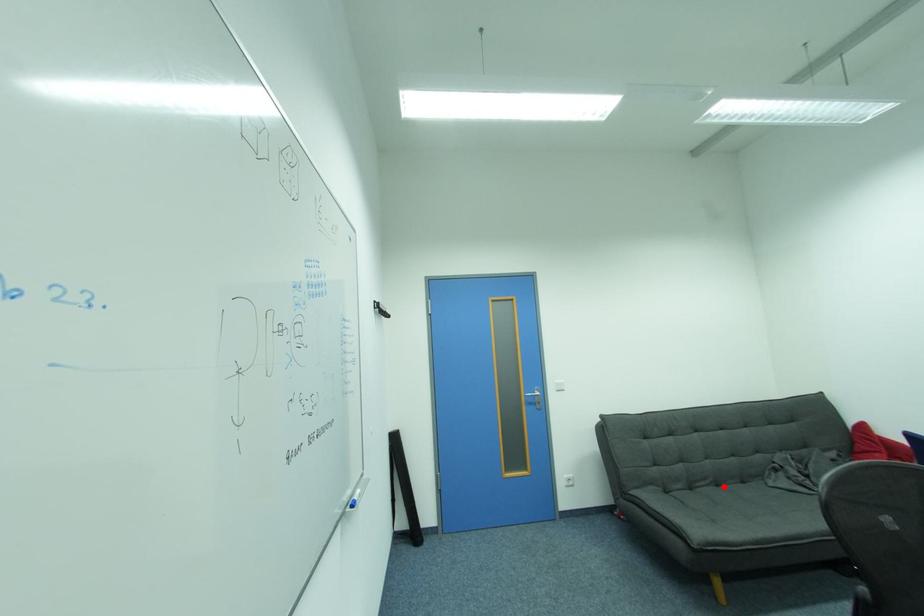
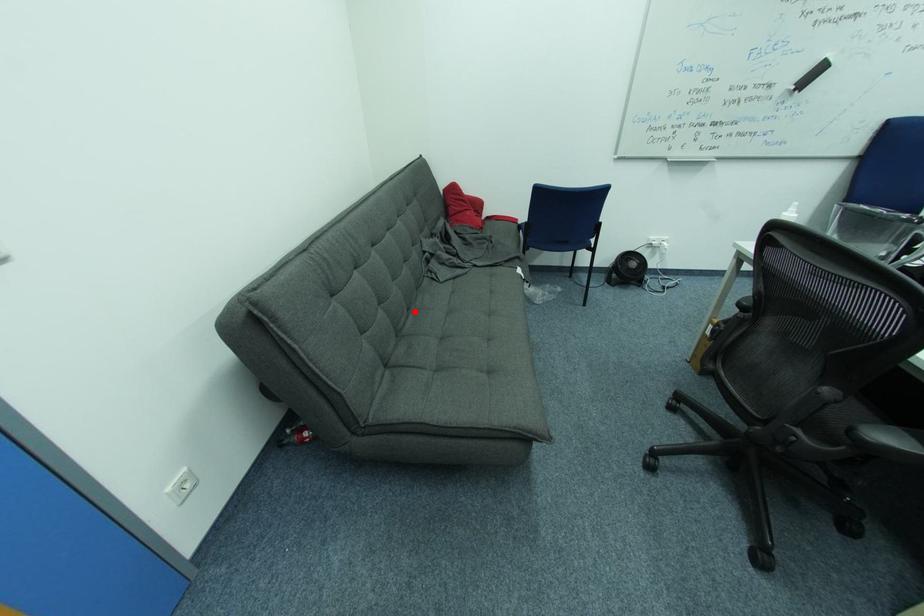
I am providing you with two images of the same scene from different viewpoints. A red point is marked on the first image and another point is marked on the second image. Does the point marked in image1 correspond to the same location as the one in image2?

Yes